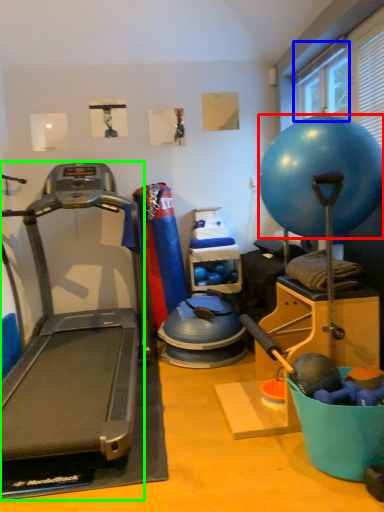
Question: Which is farther away from ball (highlighted by a red box)? window screen (highlighted by a blue box) or treadmill (highlighted by a green box)?

Choices:
 (A) window screen
 (B) treadmill

Answer: (B)